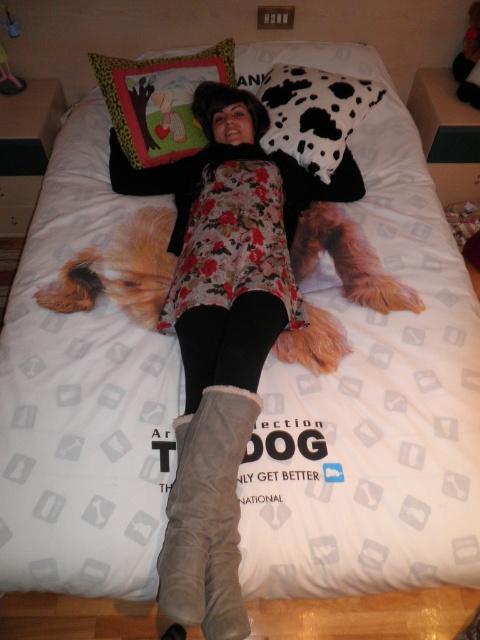
Question: Does fluffy suede boots at center have a lesser width compared to cow print fabric pillow at center?

Choices:
 (A) yes
 (B) no

Answer: (B)

Question: Among these points, which one is nearest to the camera?

Choices:
 (A) (157, 157)
 (B) (312, 161)
 (C) (227, 444)

Answer: (C)

Question: Considering the relative positions of fluffy suede boots at center and suede boots at lower center in the image provided, where is fluffy suede boots at center located with respect to suede boots at lower center?

Choices:
 (A) above
 (B) below

Answer: (A)

Question: Which object is farther from the camera taking this photo?

Choices:
 (A) suede boots at lower center
 (B) leopard print fabric pillow at upper left
 (C) cow print fabric pillow at center

Answer: (B)

Question: Is suede boots at lower center above cow print fabric pillow at center?

Choices:
 (A) yes
 (B) no

Answer: (B)

Question: Which is farther from the cow print fabric pillow at center?

Choices:
 (A) fluffy suede boots at center
 (B) suede boots at lower center

Answer: (B)